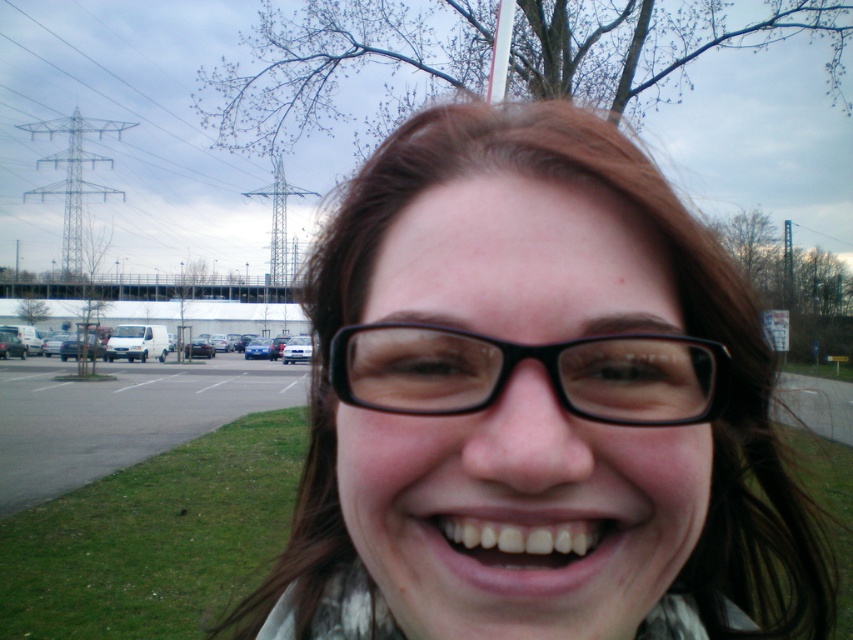
Question: Can you confirm if black matte glasses at center is smaller than black plastic glasses at center?

Choices:
 (A) yes
 (B) no

Answer: (B)

Question: Which of the following is the farthest from the observer?

Choices:
 (A) (573, 518)
 (B) (682, 522)
 (C) (657, 337)

Answer: (B)

Question: Where is black plastic glasses at center located in relation to white glossy teeth at center in the image?

Choices:
 (A) below
 (B) above

Answer: (B)

Question: Considering the relative positions of black plastic glasses at center and white glossy teeth at center in the image provided, where is black plastic glasses at center located with respect to white glossy teeth at center?

Choices:
 (A) right
 (B) left

Answer: (A)

Question: Among these points, which one is farthest from the camera?

Choices:
 (A) (335, 374)
 (B) (556, 548)

Answer: (A)

Question: Which of the following is the closest to the observer?

Choices:
 (A) (514, 124)
 (B) (630, 524)

Answer: (B)